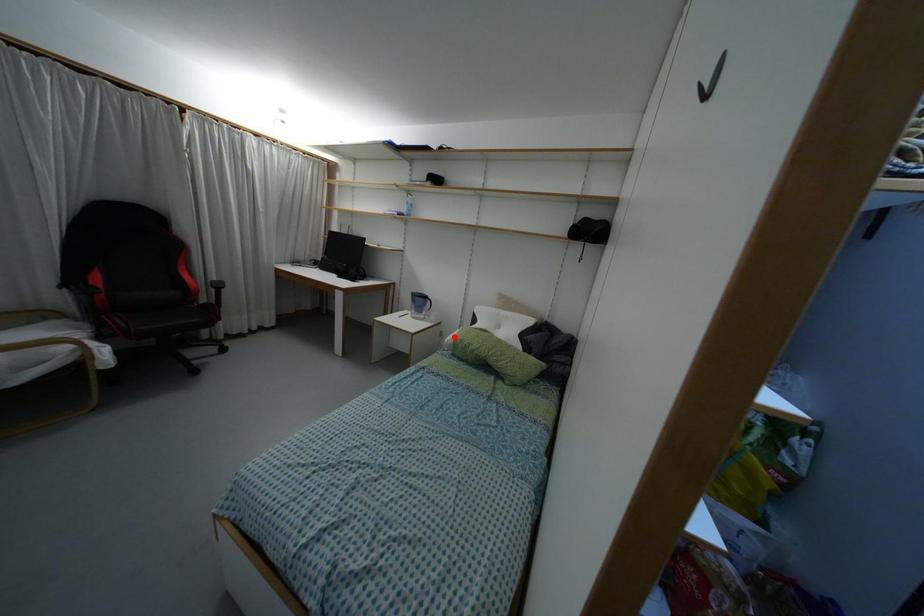
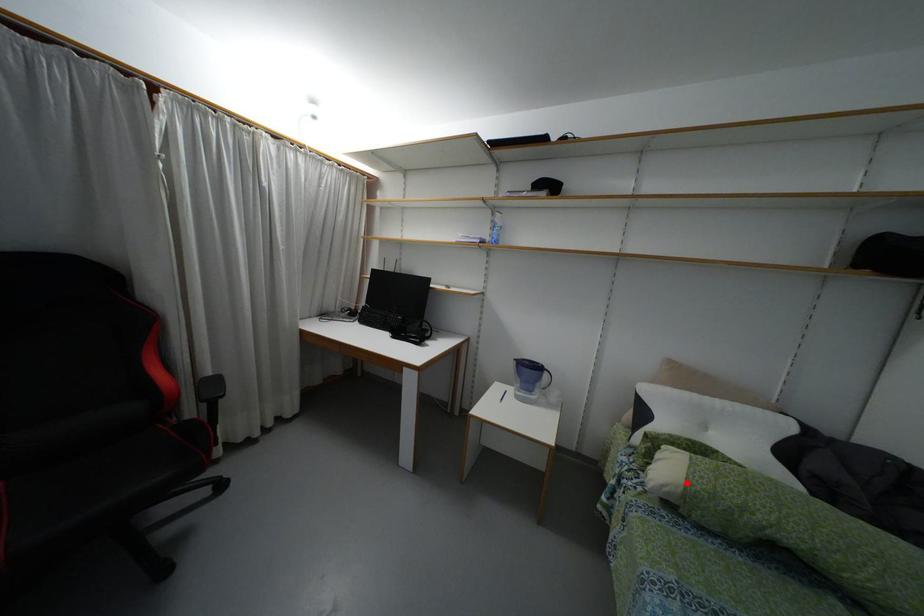
I am providing you with two images of the same scene from different viewpoints. A red point is marked on the first image and another point is marked on the second image. Do the highlighted points in image1 and image2 indicate the same real-world spot?

Yes